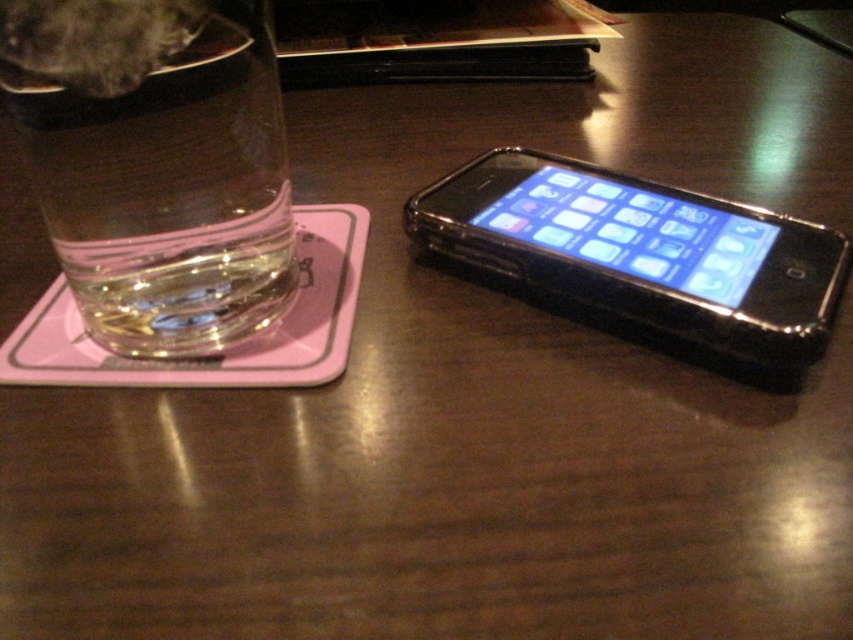
Question: Is clear glass at left behind black plastic smartphone at right?

Choices:
 (A) yes
 (B) no

Answer: (B)

Question: Which object is farther from the camera taking this photo?

Choices:
 (A) black plastic smartphone at right
 (B) clear glass at left

Answer: (A)

Question: Can you confirm if clear glass at left is positioned to the right of black plastic smartphone at right?

Choices:
 (A) yes
 (B) no

Answer: (B)

Question: Is clear glass at left to the left of black plastic smartphone at right from the viewer's perspective?

Choices:
 (A) yes
 (B) no

Answer: (A)